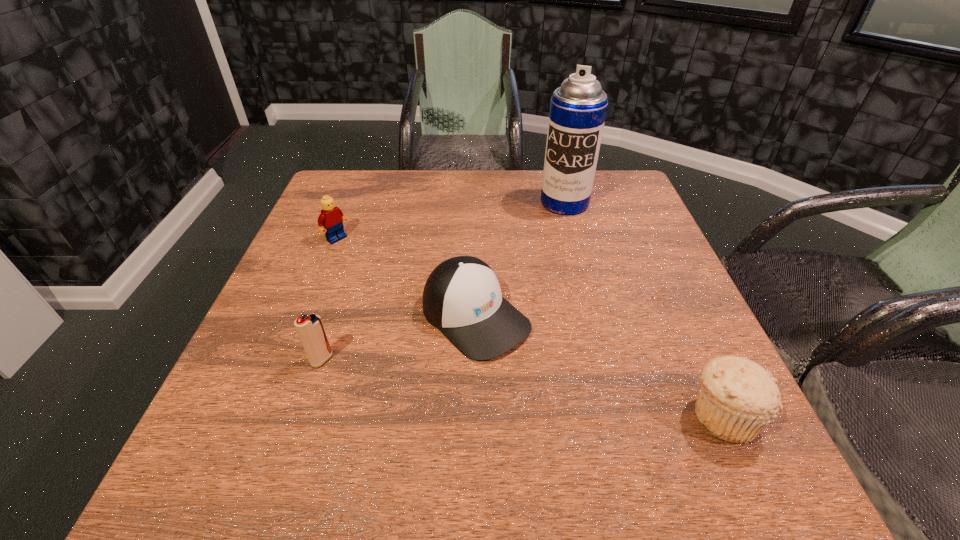
Identify the location of free space at the right edge. The width and height of the screenshot is (960, 540). (627, 308).

What are the coordinates of `free spot at the near left corner of the desktop` in the screenshot? It's located at (256, 407).

At what (x,y) coordinates should I click in order to perform the action: click on vacant space at the far right corner of the desktop. Please return your answer as a coordinate pair (x, y). The width and height of the screenshot is (960, 540). Looking at the image, I should click on (617, 175).

What are the coordinates of `free space between the nearest object and the third object from right to left` in the screenshot? It's located at (599, 366).

Identify the location of free spot between the second object from left to right and the leftmost object. The image size is (960, 540). (329, 299).

Identify the location of empty location between the second object from left to right and the leftmost object. (329, 299).

Where is `vacant space that's between the fourth nearest object and the cap`? The height and width of the screenshot is (540, 960). vacant space that's between the fourth nearest object and the cap is located at coordinates (406, 278).

Image resolution: width=960 pixels, height=540 pixels. In order to click on free point between the Lego and the igniter in this screenshot , I will do `click(329, 299)`.

The height and width of the screenshot is (540, 960). Identify the location of unoccupied position between the fourth object from right to left and the rightmost object. (522, 387).

This screenshot has height=540, width=960. Identify the location of free space between the igniter and the cap. (399, 339).